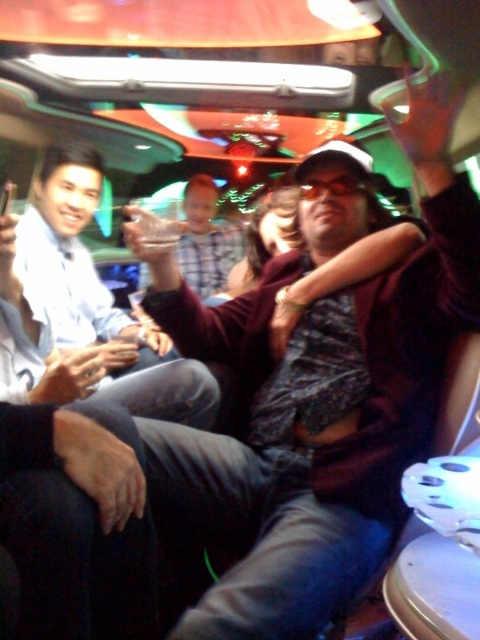
You are inside the party bus and want to place a small decoration between the two points, point (188, 416) and point (212, 246). Which point is closer to you where you should start placing the decoration?

Point (188, 416) is closer to the viewer than point (212, 246), so you should start placing the decoration near point (188, 416) first.

You are a photographer taking a photo of the party scene. You notice the matte white shirt at left and the plaid shirt at center. Which person should you focus on to capture their full height in the frame?

The matte white shirt at left is taller than the plaid shirt at center, so focusing on the matte white shirt at left would ensure capturing their full height since they are taller.